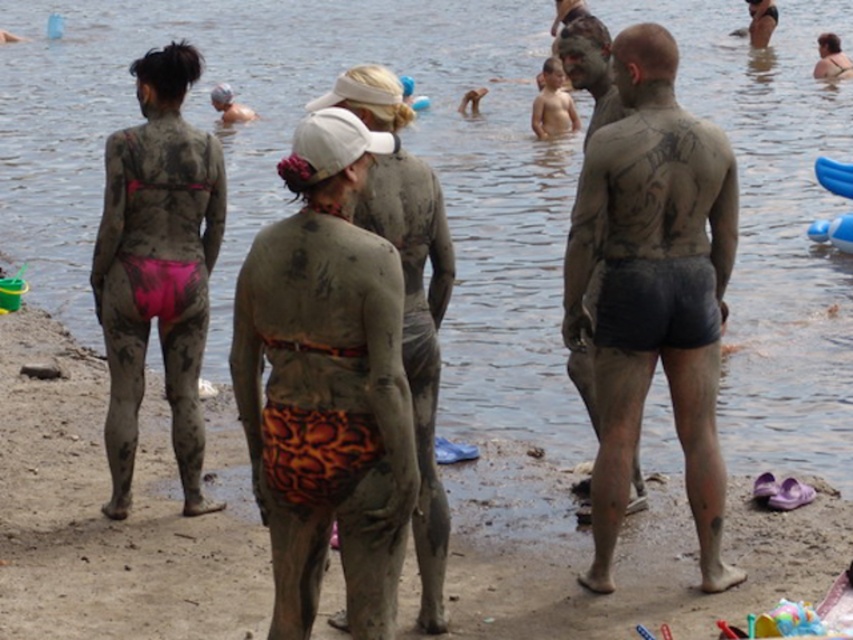
Who is higher up, muddy skin shorts at center or orange textured shorts at center?

Positioned higher is muddy skin shorts at center.

Does muddy skin shorts at center come in front of orange textured shorts at center?

No.

Does point (715, 164) come in front of point (421, 186)?

No, it is behind (421, 186).

Find the location of a particular element. The width and height of the screenshot is (853, 640). muddy skin shorts at center is located at coordinates (653, 289).

Can you confirm if muddy skin shorts at center is positioned below muddy pink bikini bottom at back left?

Yes.

Between muddy skin shorts at center and muddy pink bikini bottom at back left, which one is positioned lower?

Positioned lower is muddy skin shorts at center.

Which is behind, point (659, 227) or point (123, 129)?

The point (123, 129) is more distant.

I want to click on muddy skin shorts at center, so click(x=653, y=289).

The width and height of the screenshot is (853, 640). Describe the element at coordinates (157, 268) in the screenshot. I see `muddy pink bikini bottom at back left` at that location.

Does point (165, 212) come behind point (378, 216)?

Yes.

The height and width of the screenshot is (640, 853). Identify the location of muddy pink bikini bottom at back left. (157, 268).